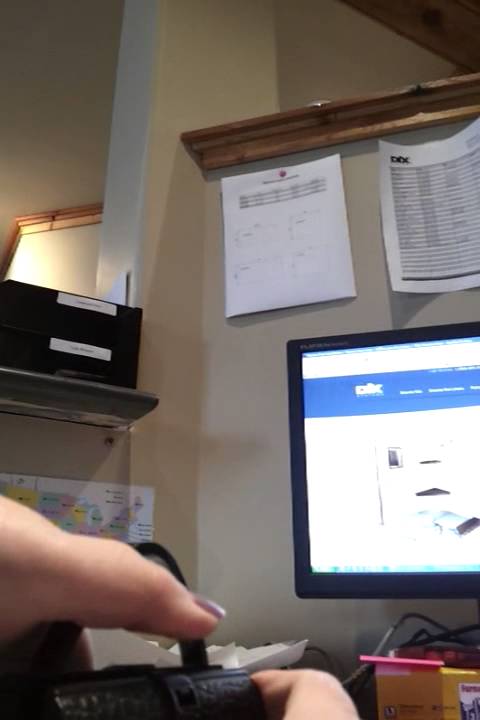
Locate an element on the screen. The height and width of the screenshot is (720, 480). thumbtack is located at coordinates (282, 174).